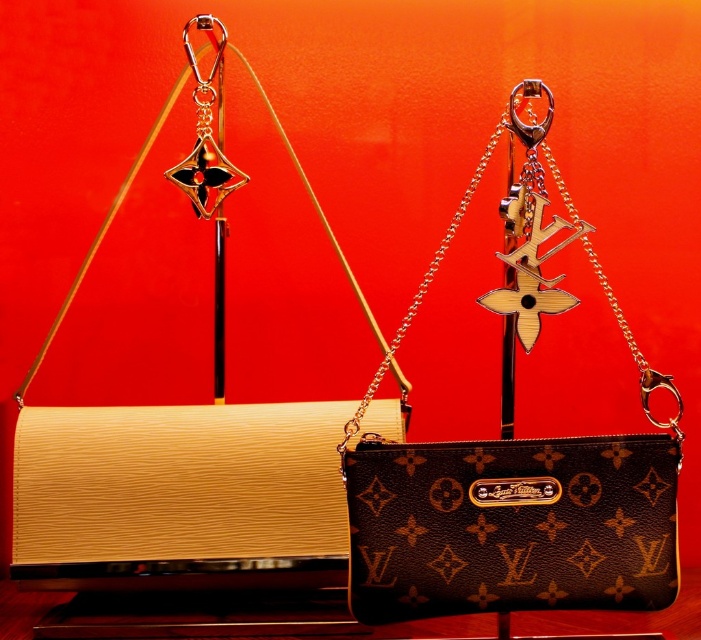
Question: From the image, what is the correct spatial relationship of brown monogrammed leather handbag at center in relation to metallic gold hook at upper center?

Choices:
 (A) right
 (B) left

Answer: (A)

Question: Can you confirm if brown monogrammed leather handbag at center is positioned below metallic gold hook at upper center?

Choices:
 (A) no
 (B) yes

Answer: (B)

Question: Which object appears closest to the camera in this image?

Choices:
 (A) brown monogrammed leather handbag at center
 (B) metallic gold hook at upper center

Answer: (A)

Question: Which object appears closest to the camera in this image?

Choices:
 (A) metallic gold hook at upper center
 (B) brown monogrammed leather handbag at center

Answer: (B)

Question: Which point is closer to the camera?

Choices:
 (A) brown monogrammed leather handbag at center
 (B) metallic gold hook at upper center

Answer: (A)

Question: Is brown monogrammed leather handbag at center below metallic gold hook at upper center?

Choices:
 (A) yes
 (B) no

Answer: (A)